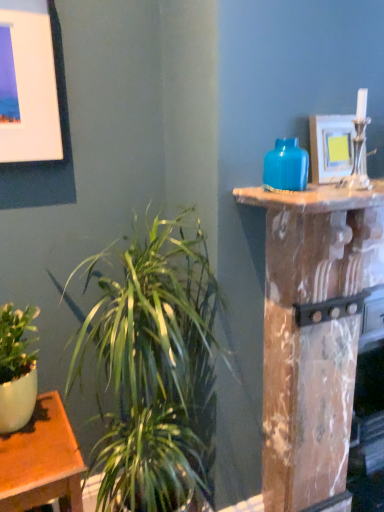
At what (x,y) coordinates should I click in order to perform the action: click on green leafy plant at center. Please return your answer as a coordinate pair (x, y). Looking at the image, I should click on (x=153, y=369).

What are the coordinates of `matte white picture frame at upper left, the first picture frame from the left` in the screenshot? It's located at (30, 87).

Where is `matte white picture frame at upper right, the 1th picture frame in the right-to-left sequence`? This screenshot has width=384, height=512. matte white picture frame at upper right, the 1th picture frame in the right-to-left sequence is located at coordinates (331, 147).

Find the location of `green leafy plant at center`. green leafy plant at center is located at coordinates (153, 369).

From the image's perspective, count 2nd picture frames upward from the matte blue vase at upper right and point to it. Please provide its 2D coordinates.

[(30, 87)]

Considering their positions, is matte white picture frame at upper left, which is the 2th picture frame in right-to-left order, located in front of or behind matte blue vase at upper right?

matte white picture frame at upper left, which is the 2th picture frame in right-to-left order, is positioned farther from the viewer than matte blue vase at upper right.

Which object is positioned more to the right, matte white picture frame at upper left, which is the 2th picture frame in right-to-left order, or matte blue vase at upper right?

matte blue vase at upper right.

Is matte white picture frame at upper left, which is the 2th picture frame in right-to-left order, not within matte blue vase at upper right?

Indeed, matte white picture frame at upper left, which is the 2th picture frame in right-to-left order, is completely outside matte blue vase at upper right.

Considering the sizes of objects matte white picture frame at upper left, which is the 2th picture frame in right-to-left order, and marble pillar at right in the image provided, who is bigger, matte white picture frame at upper left, which is the 2th picture frame in right-to-left order, or marble pillar at right?

With larger size is marble pillar at right.

Is matte white picture frame at upper left, the first picture frame from the left, wider or thinner than marble pillar at right?

In the image, matte white picture frame at upper left, the first picture frame from the left, appears to be more narrow than marble pillar at right.

Consider the image. Which object is closer to the camera taking this photo, matte white picture frame at upper left, which is the 2th picture frame in right-to-left order, or marble pillar at right?

marble pillar at right is closer to the camera.

Identify the location of picture frame that is the 2nd object above the marble pillar at right (from a real-world perspective). (30, 87).

From the image's perspective, which one is positioned lower, green leafy plant at center or matte white picture frame at upper left, which is the 2th picture frame in right-to-left order?

green leafy plant at center appears lower in the image.

From a real-world perspective, is green leafy plant at center physically located above or below matte white picture frame at upper left, which is the 2th picture frame in right-to-left order?

Clearly, from a real-world perspective, green leafy plant at center is below matte white picture frame at upper left, which is the 2th picture frame in right-to-left order.

Does green leafy plant at center have a smaller size compared to matte white picture frame at upper left, the first picture frame from the left?

Incorrect, green leafy plant at center is not smaller in size than matte white picture frame at upper left, the first picture frame from the left.

Is marble pillar at right far away from matte blue vase at upper right?

No, marble pillar at right is in close proximity to matte blue vase at upper right.

Which is nearer, (293,365) or (276,150)?

The point (276,150) is in front.

From the image's perspective, is marble pillar at right located beneath matte blue vase at upper right?

Correct, marble pillar at right appears lower than matte blue vase at upper right in the image.

Locate an element on the screen. The width and height of the screenshot is (384, 512). vase above the marble pillar at right (from a real-world perspective) is located at coordinates (286, 166).

Would you say marble pillar at right is to the left or to the right of matte white picture frame at upper left, which is the 2th picture frame in right-to-left order, in the picture?

Clearly, marble pillar at right is on the right of matte white picture frame at upper left, which is the 2th picture frame in right-to-left order, in the image.

Which is less distant, (282, 446) or (3, 59)?

Point (3, 59)

From a real-world perspective, between marble pillar at right and matte white picture frame at upper left, the first picture frame from the left, who is vertically higher?

From a 3D spatial view, matte white picture frame at upper left, the first picture frame from the left, is above.

This screenshot has height=512, width=384. In the image, there is a matte white picture frame at upper left, the first picture frame from the left. Find the location of `pillar below it (from the image's perspective)`. pillar below it (from the image's perspective) is located at coordinates (313, 332).

Is marble pillar at right positioned in front of green leafy plant at center?

No, it is not.

Which of these two, marble pillar at right or green leafy plant at center, is smaller?

With smaller size is green leafy plant at center.

Is marble pillar at right shorter than green leafy plant at center?

Indeed, marble pillar at right has a lesser height compared to green leafy plant at center.

Consider the image. Is marble pillar at right situated inside green leafy plant at center or outside?

marble pillar at right is spatially situated outside green leafy plant at center.

Does marble pillar at right turn towards matte white picture frame at upper right, which is the 2th picture frame in left-to-right order?

No, marble pillar at right is not facing towards matte white picture frame at upper right, which is the 2th picture frame in left-to-right order.

Which object is positioned more to the right, marble pillar at right or matte white picture frame at upper right, which is the 2th picture frame in left-to-right order?

marble pillar at right is more to the right.

Is marble pillar at right far from matte white picture frame at upper right, the 1th picture frame in the right-to-left sequence?

No, there isn't a large distance between marble pillar at right and matte white picture frame at upper right, the 1th picture frame in the right-to-left sequence.

Is marble pillar at right situated inside matte white picture frame at upper right, the 1th picture frame in the right-to-left sequence, or outside?

marble pillar at right is located beyond the bounds of matte white picture frame at upper right, the 1th picture frame in the right-to-left sequence.

Image resolution: width=384 pixels, height=512 pixels. Find the location of `picture frame on the left of matte blue vase at upper right`. picture frame on the left of matte blue vase at upper right is located at coordinates (30, 87).

The image size is (384, 512). Find the location of `pillar below the matte white picture frame at upper left, the first picture frame from the left (from the image's perspective)`. pillar below the matte white picture frame at upper left, the first picture frame from the left (from the image's perspective) is located at coordinates (313, 332).

Estimate the real-world distances between objects in this image. Which object is closer to matte white picture frame at upper right, the 1th picture frame in the right-to-left sequence, matte white picture frame at upper left, the first picture frame from the left, or matte blue vase at upper right?

matte blue vase at upper right is closer to matte white picture frame at upper right, the 1th picture frame in the right-to-left sequence.

Which object lies further to the anchor point marble pillar at right, matte white picture frame at upper right, the 1th picture frame in the right-to-left sequence, or matte white picture frame at upper left, which is the 2th picture frame in right-to-left order?

matte white picture frame at upper left, which is the 2th picture frame in right-to-left order.

Looking at the image, which one is located closer to green leafy plant at center, matte white picture frame at upper right, the 1th picture frame in the right-to-left sequence, or marble pillar at right?

marble pillar at right is closer to green leafy plant at center.

Based on their spatial positions, is matte white picture frame at upper left, the first picture frame from the left, or matte white picture frame at upper right, the 1th picture frame in the right-to-left sequence, closer to green leafy plant at center?

The object closer to green leafy plant at center is matte white picture frame at upper left, the first picture frame from the left.

Looking at the image, which one is located closer to matte white picture frame at upper left, which is the 2th picture frame in right-to-left order, green leafy plant at center or matte white picture frame at upper right, which is the 2th picture frame in left-to-right order?

The object closer to matte white picture frame at upper left, which is the 2th picture frame in right-to-left order, is green leafy plant at center.

Looking at the image, which one is located closer to matte white picture frame at upper right, the 1th picture frame in the right-to-left sequence, matte blue vase at upper right or green leafy plant at center?

matte blue vase at upper right.

Which object lies further to the anchor point matte blue vase at upper right, marble pillar at right or matte white picture frame at upper right, which is the 2th picture frame in left-to-right order?

marble pillar at right.

Looking at the image, which one is located further to matte white picture frame at upper left, the first picture frame from the left, matte blue vase at upper right or green leafy plant at center?

The object further to matte white picture frame at upper left, the first picture frame from the left, is matte blue vase at upper right.

Locate an element on the screen. The height and width of the screenshot is (512, 384). vase that lies between matte white picture frame at upper left, which is the 2th picture frame in right-to-left order, and green leafy plant at center from top to bottom is located at coordinates (286, 166).

What are the coordinates of `vase between green leafy plant at center and marble pillar at right from left to right` in the screenshot? It's located at (286, 166).

Locate an element on the screen. The width and height of the screenshot is (384, 512). picture frame between matte white picture frame at upper left, which is the 2th picture frame in right-to-left order, and marble pillar at right, in the horizontal direction is located at coordinates (331, 147).

This screenshot has height=512, width=384. I want to click on vase between matte white picture frame at upper right, the 1th picture frame in the right-to-left sequence, and green leafy plant at center from top to bottom, so click(286, 166).